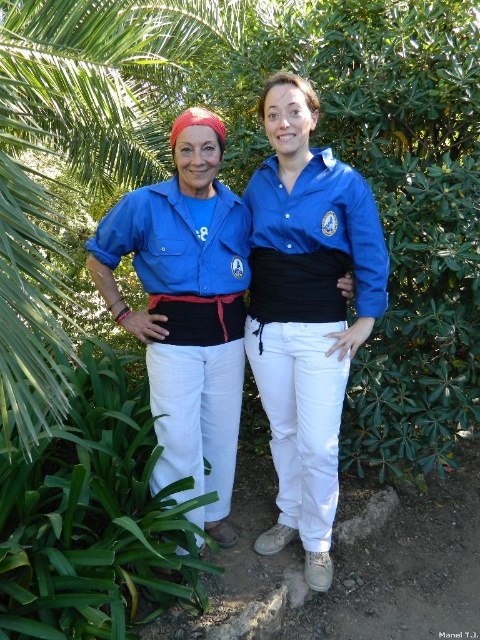
You are a photographer setting up for a group photo. You want to ensure that both the green leafy plant at lower left and the blue cotton shirt at center are in focus. Which object should you focus on first to ensure both are sharp?

The green leafy plant at lower left is closer to the viewer than the blue cotton shirt at center. To ensure both are in focus, you should focus on the green leafy plant at lower left first, as it is the closer object, and use a small aperture or depth of field technique to include the blue cotton shirt at center in the sharp range.

You are a photographer trying to capture a portrait of both the green leafy plant at lower left and the matte blue shirt at left. Since you want both subjects to be in the frame, which direction should you move your camera to include both?

The green leafy plant at lower left is to the left of the matte blue shirt at left, so you should move your camera to the left to include both subjects in the frame.